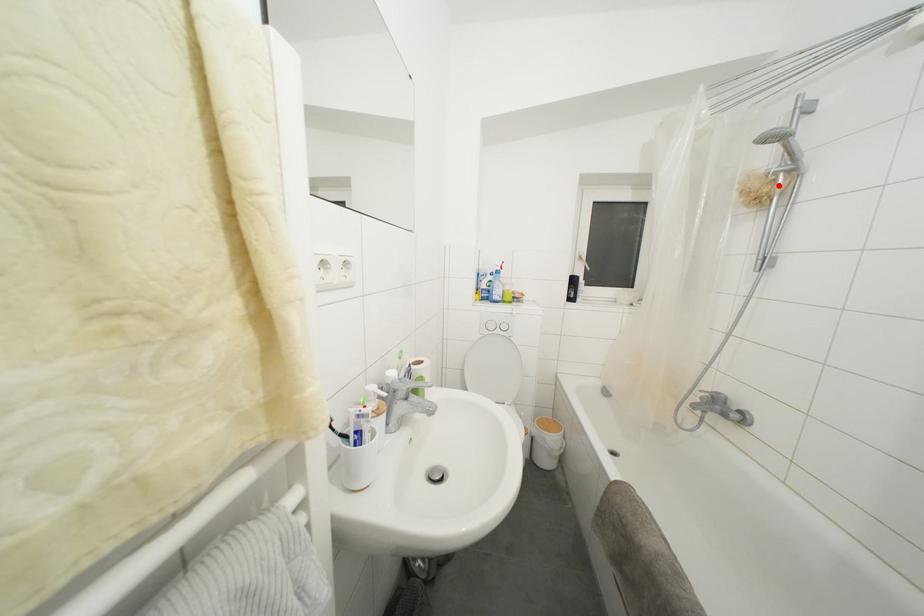
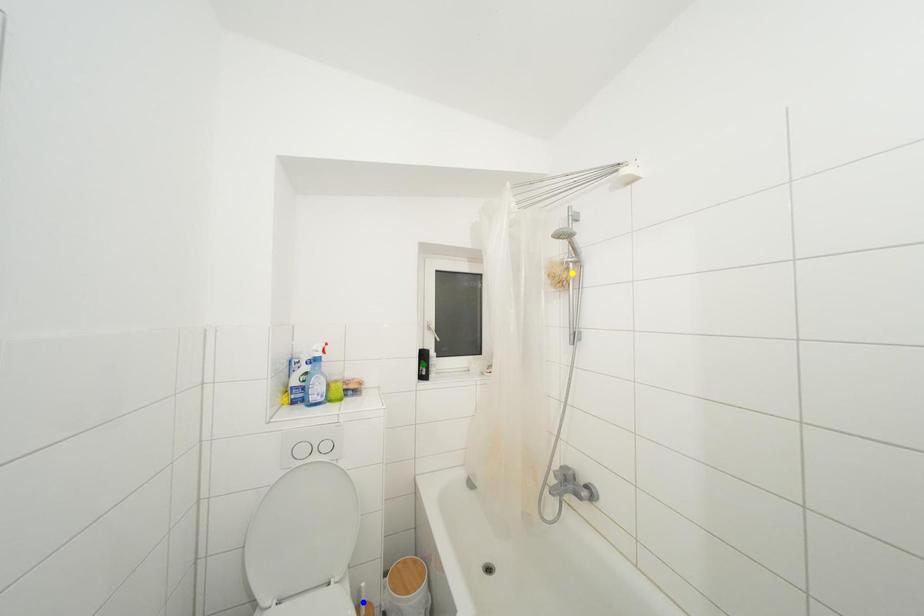
Question: I am providing you with two images of the same scene from different viewpoints. A red point is marked on the first image. You are given multiple points on the second image. Which point in image 2 is actually the same real-world point as the red point in image 1?

Choices:
 (A) yellow point
 (B) green point
 (C) blue point

Answer: (A)